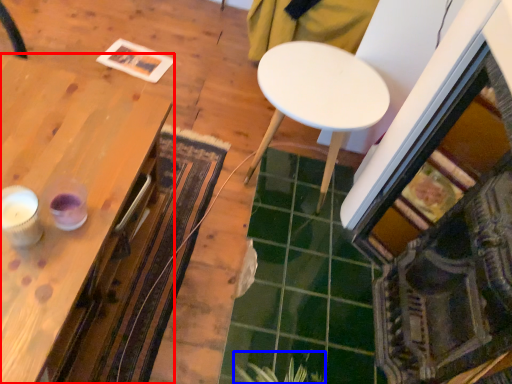
Question: Which of the following is the farthest to the observer, table (highlighted by a red box) or plant (highlighted by a blue box)?

Choices:
 (A) table
 (B) plant

Answer: (B)